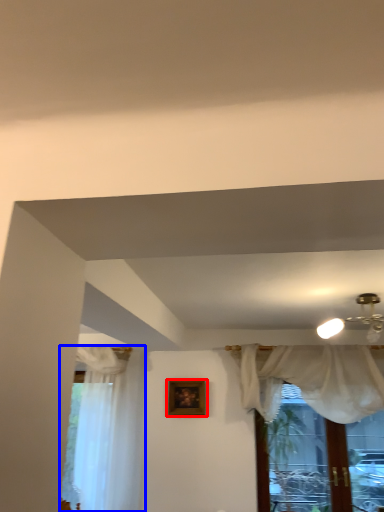
Question: Among these objects, which one is nearest to the camera, picture frame (highlighted by a red box) or curtain (highlighted by a blue box)?

Choices:
 (A) picture frame
 (B) curtain

Answer: (B)